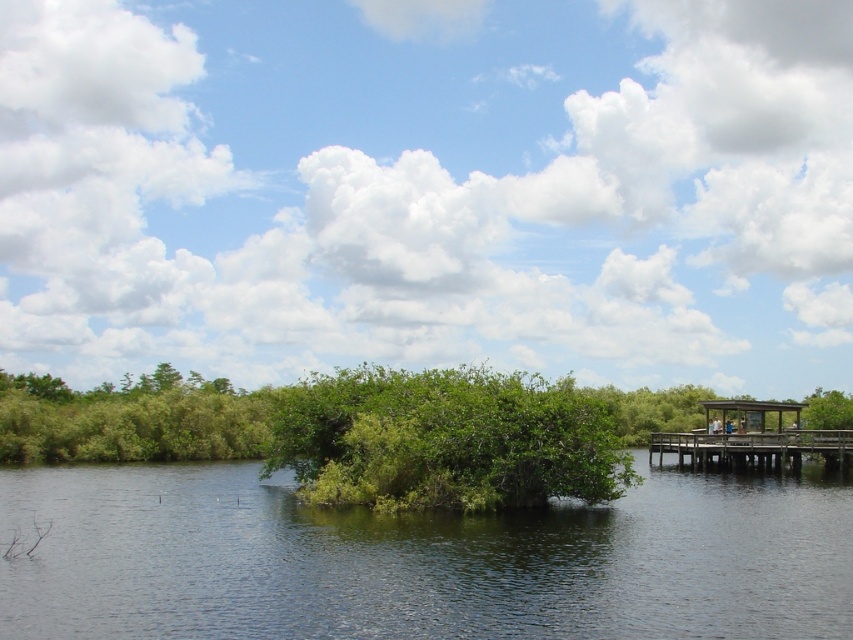
Is green leafy river at center above green leafy bush at center?

No, green leafy river at center is not above green leafy bush at center.

Between point (189, 518) and point (415, 403), which one is positioned behind?

Positioned behind is point (415, 403).

Where is `green leafy river at center`? green leafy river at center is located at coordinates (421, 561).

Which is below, green leafy river at center or brown wooden dock at right?

brown wooden dock at right

Does point (201, 634) lie in front of point (675, 448)?

Yes.

Locate an element on the screen. green leafy river at center is located at coordinates (421, 561).

Does green leafy bush at center appear on the right side of brown wooden dock at right?

Incorrect, green leafy bush at center is not on the right side of brown wooden dock at right.

Is green leafy bush at center positioned behind brown wooden dock at right?

No, it is not.

Between point (454, 392) and point (799, 451), which one is positioned in front?

Positioned in front is point (454, 392).

I want to click on green leafy bush at center, so click(444, 440).